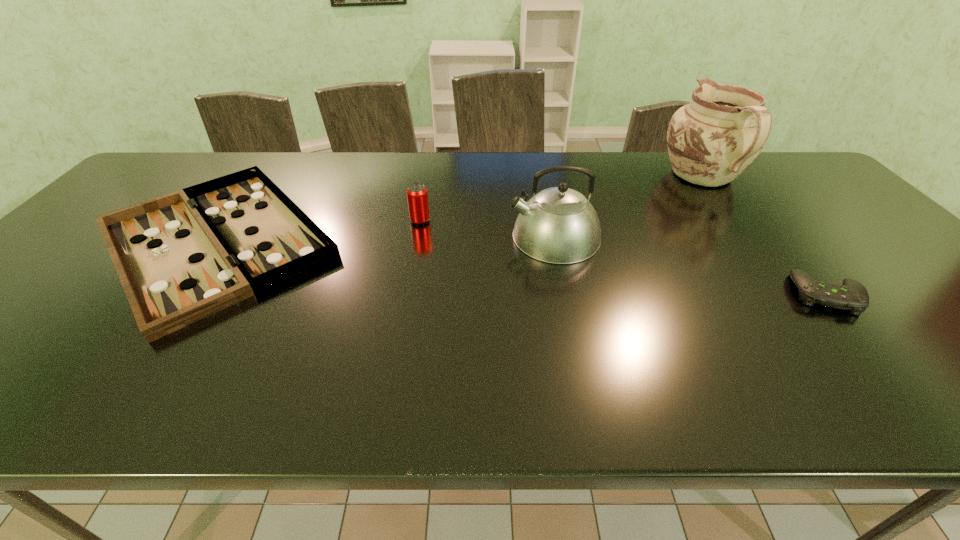
Find the location of a particular element. The image size is (960, 540). free spot located on the front of the control is located at coordinates (919, 404).

Image resolution: width=960 pixels, height=540 pixels. In order to click on object that is at the far edge in this screenshot , I will do `click(711, 141)`.

You are a GUI agent. You are given a task and a screenshot of the screen. Output one action in this format:
    pyautogui.click(x=<x>, y=<y>)
    Task: Click on the vacant space at the far edge
    The width and height of the screenshot is (960, 540).
    Given the screenshot: What is the action you would take?
    pyautogui.click(x=404, y=175)

This screenshot has height=540, width=960. What are the coordinates of `vacant space at the near edge of the desktop` in the screenshot? It's located at (756, 396).

In the image, there is a desktop. Identify the location of vacant space at the left edge. The width and height of the screenshot is (960, 540). (13, 324).

I want to click on vacant area at the far left corner of the desktop, so click(197, 166).

Identify the location of free spot between the can and the kettle. Image resolution: width=960 pixels, height=540 pixels. (487, 228).

Locate an element on the screen. The height and width of the screenshot is (540, 960). vacant point located between the can and the control is located at coordinates (623, 257).

Where is `unoccupied area between the third object from right to left and the control`? Image resolution: width=960 pixels, height=540 pixels. unoccupied area between the third object from right to left and the control is located at coordinates (690, 265).

At what (x,y) coordinates should I click in order to perform the action: click on the fourth closest object relative to the control. Please return your answer as a coordinate pair (x, y). The width and height of the screenshot is (960, 540). Looking at the image, I should click on (183, 256).